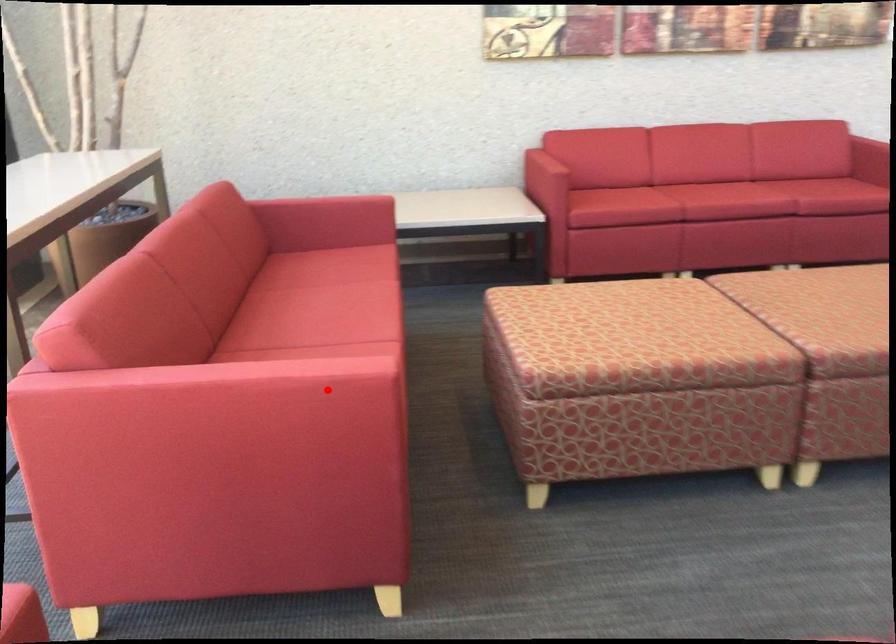
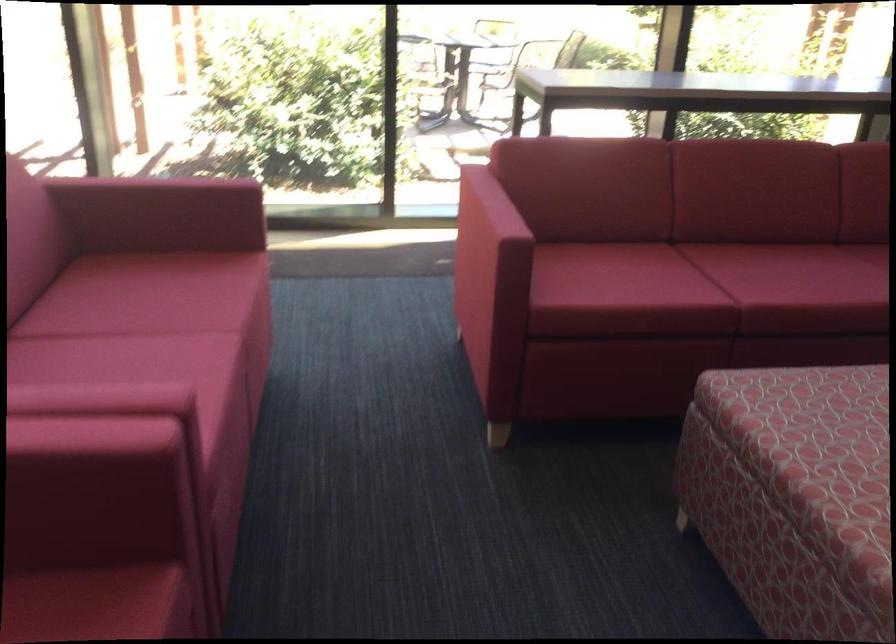
The point at the highlighted location is marked in the first image. Where is the corresponding point in the second image?

(487, 222)